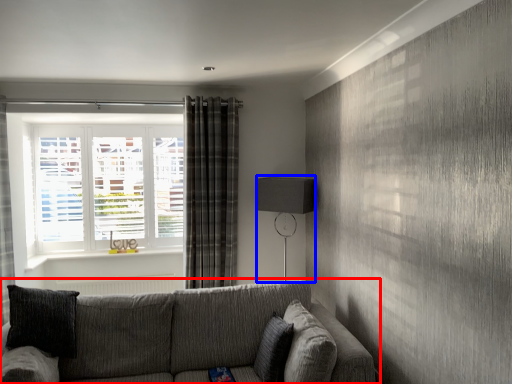
Question: Which point is closer to the camera, studio couch (highlighted by a red box) or table lamp (highlighted by a blue box)?

Choices:
 (A) studio couch
 (B) table lamp

Answer: (A)